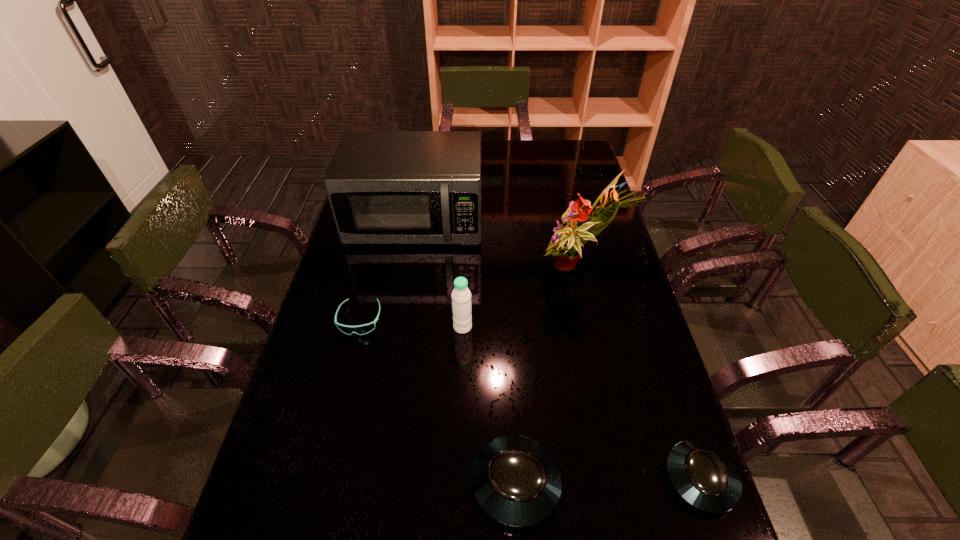
Image resolution: width=960 pixels, height=540 pixels. Find the location of `the taller saucer`. the taller saucer is located at coordinates (515, 479).

Identify the location of the third shortest object. (515, 479).

This screenshot has height=540, width=960. What are the coordinates of `the second shortest object` in the screenshot? It's located at (701, 474).

The height and width of the screenshot is (540, 960). I want to click on the right saucer, so click(x=701, y=474).

Where is `the fifth shortest object`? the fifth shortest object is located at coordinates (384, 187).

What are the coordinates of `sunglasses` in the screenshot? It's located at (366, 328).

The height and width of the screenshot is (540, 960). I want to click on the tallest object, so click(x=565, y=246).

Where is `the fourth shortest object`? The height and width of the screenshot is (540, 960). the fourth shortest object is located at coordinates (461, 296).

Locate an element on the screen. free location located 0.210m on the left of the left saucer is located at coordinates (372, 483).

You are a GUI agent. You are given a task and a screenshot of the screen. Output one action in this format:
    pyautogui.click(x=<x>, y=<y>)
    Task: Click on the vacant space located on the left of the fifth tallest object
    The image size is (960, 540).
    Given the screenshot: What is the action you would take?
    609,478